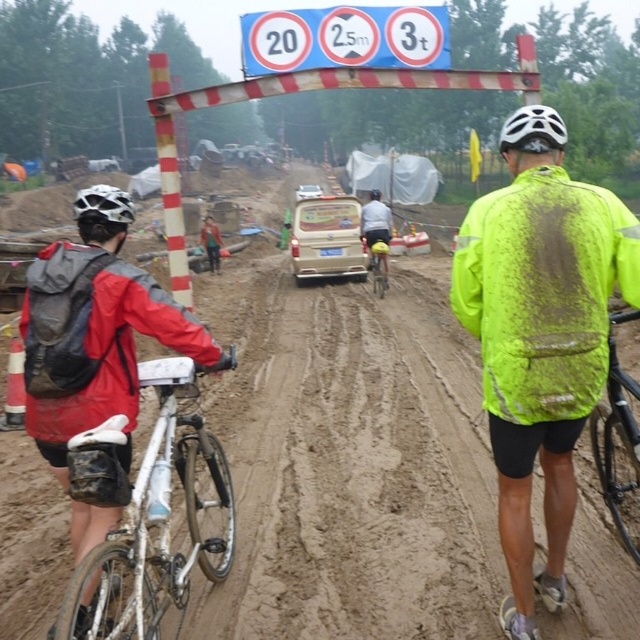
Question: Is white matte mountain bike at left smaller than yellow matte bicycle at center?

Choices:
 (A) no
 (B) yes

Answer: (A)

Question: Among these points, which one is farthest from the camera?

Choices:
 (A) [x=371, y=253]
 (B) [x=605, y=477]

Answer: (A)

Question: From the image, what is the correct spatial relationship of white matte mountain bike at left in relation to black matte mountain bike at center?

Choices:
 (A) below
 (B) above

Answer: (A)

Question: In this image, where is neon yellow jacket at center located relative to white matte bicycle helmet at upper center?

Choices:
 (A) below
 (B) above

Answer: (A)

Question: Which of these objects is positioned closest to the yellow matte bicycle at center?

Choices:
 (A) neon yellow jacket at center
 (B) neon yellow jacket at rear
 (C) matte black helmet at upper left

Answer: (C)

Question: Which of the following is the farthest from the observer?

Choices:
 (A) (532, 404)
 (B) (472, 324)
 (C) (554, 131)

Answer: (B)